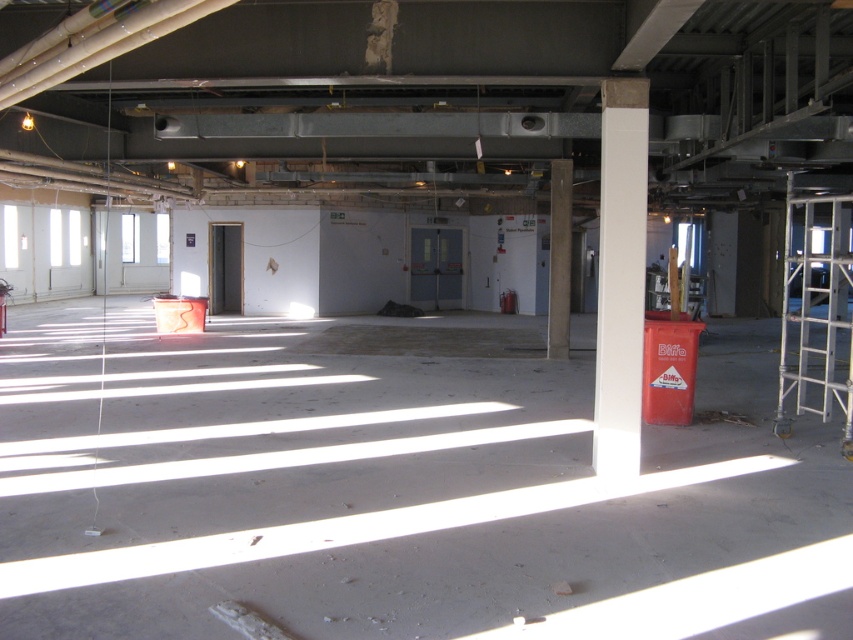
Who is positioned more to the left, white smooth column at right or white marble pillar at center?

white smooth column at right is more to the left.

Who is more distant from viewer, (x=630, y=268) or (x=556, y=198)?

The point (x=556, y=198) is behind.

Find the location of a particular element. white smooth column at right is located at coordinates (619, 275).